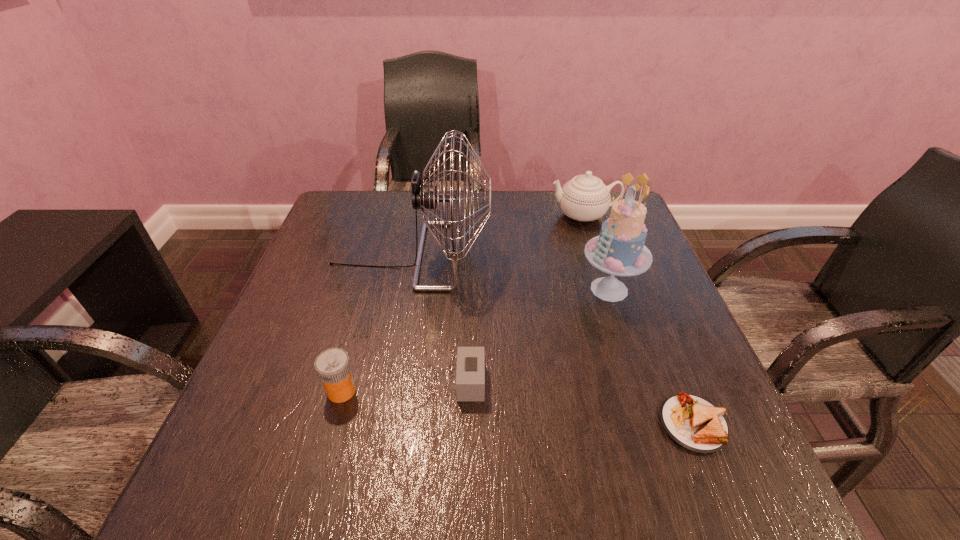
Select which object appears as the third closest to the sandwich. Please provide its 2D coordinates. Your answer should be formatted as a tuple, i.e. [(x, y)], where the tuple contains the x and y coordinates of a point satisfying the conditions above.

[(425, 196)]

In order to click on blank space that satisfies the following two spatial constraints: 1. on the front-facing side of the fan; 2. on the back side of the shortest object in this screenshot , I will do `click(379, 424)`.

Find the location of a particular element. This screenshot has height=540, width=960. vacant space that satisfies the following two spatial constraints: 1. on the front-facing side of the fan; 2. on the back side of the shortest object is located at coordinates (379, 424).

Find the location of a particular element. The width and height of the screenshot is (960, 540). free space that satisfies the following two spatial constraints: 1. with a ladder on the side of the sandwich; 2. on the right side of the cake is located at coordinates (653, 424).

At what (x,y) coordinates should I click in order to perform the action: click on vacant area in the image that satisfies the following two spatial constraints: 1. on the front-facing side of the fan; 2. on the right side of the sandwich. Please return your answer as a coordinate pair (x, y). Image resolution: width=960 pixels, height=540 pixels. Looking at the image, I should click on (x=379, y=424).

This screenshot has width=960, height=540. Find the location of `free space that satisfies the following two spatial constraints: 1. on the front-facing side of the alarm clock; 2. on the back side of the sandwich`. free space that satisfies the following two spatial constraints: 1. on the front-facing side of the alarm clock; 2. on the back side of the sandwich is located at coordinates (469, 424).

Where is `vacant space that satisfies the following two spatial constraints: 1. on the spout of the shortest object; 2. on the right side of the chinaware`? The height and width of the screenshot is (540, 960). vacant space that satisfies the following two spatial constraints: 1. on the spout of the shortest object; 2. on the right side of the chinaware is located at coordinates (651, 424).

The width and height of the screenshot is (960, 540). I want to click on vacant space that satisfies the following two spatial constraints: 1. on the front-facing side of the shortest object; 2. on the right side of the alarm clock, so click(469, 424).

Image resolution: width=960 pixels, height=540 pixels. Find the location of `free space in the image that satisfies the following two spatial constraints: 1. with a ladder on the side of the cake; 2. on the left side of the sandwich`. free space in the image that satisfies the following two spatial constraints: 1. with a ladder on the side of the cake; 2. on the left side of the sandwich is located at coordinates (653, 424).